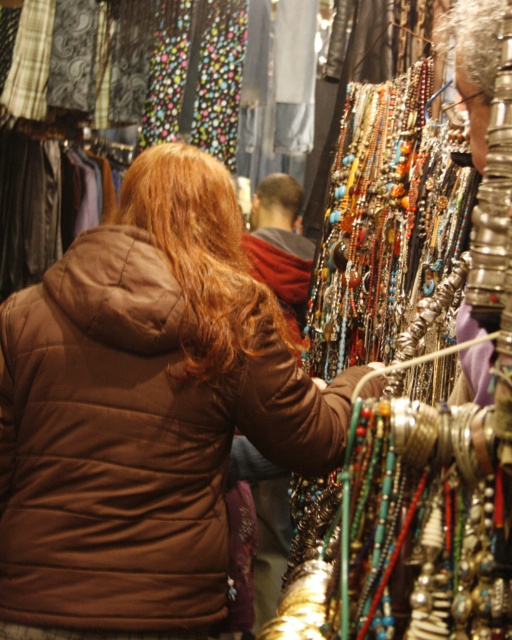
You are a photographer trying to capture the person in the brown quilted jacket at center and their brown shiny hair at upper center. Which object should you focus on first if you want to ensure both are in the frame?

The brown quilted jacket at center is positioned on the left side of brown shiny hair at upper center, so you should focus on the brown quilted jacket at center first to ensure both are in the frame.

From the picture: You are a tailor measuring for a jacket. You see the brown quilted jacket at center and the brown wavy hair at center. Which one is wider?

The brown quilted jacket at center is wider than the brown wavy hair at center according to the description.

Based on the photo, you are a photographer trying to capture the best angle of the colorful necklaces and bracelets. You notice two points in the scene marked as point 1 at coordinates point [147,225] and point 2 at coordinates point [274,176]. Which point should you focus on to ensure it appears larger in your photo?

Point 1 at coordinates point [147,225] is closer to the camera than point 2 at coordinates point [274,176], so focusing on point 1 will make it appear larger in the photo.